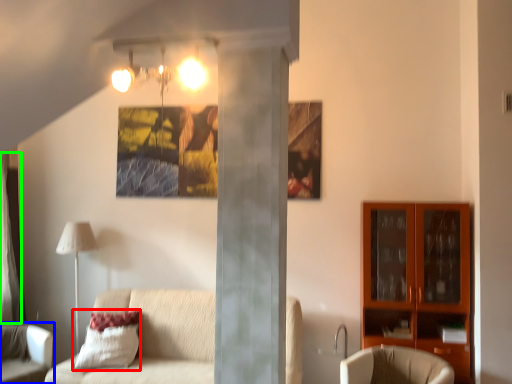
Question: Considering the real-world distances, which object is closest to pillow (highlighted by a red box)? chair (highlighted by a blue box) or curtain (highlighted by a green box).

Choices:
 (A) chair
 (B) curtain

Answer: (A)